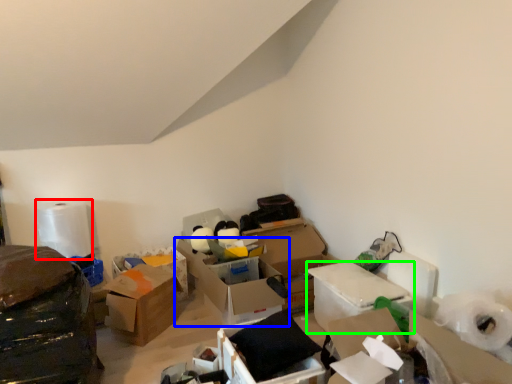
Question: Considering the real-world distances, which object is farthest from toilet paper (highlighted by a red box)? box (highlighted by a blue box) or box (highlighted by a green box)?

Choices:
 (A) box
 (B) box

Answer: (B)